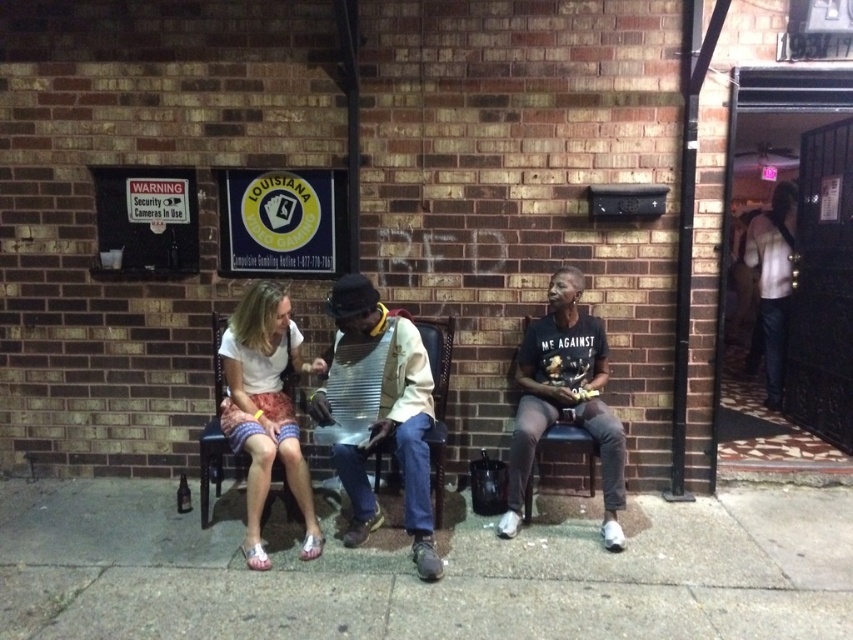
Between gray concrete pavement at lower center and white shirt at right, which one is positioned higher?

white shirt at right is above.

Consider the image. Is gray concrete pavement at lower center wider than white shirt at right?

Yes, gray concrete pavement at lower center is wider than white shirt at right.

Where is `gray concrete pavement at lower center`? gray concrete pavement at lower center is located at coordinates (415, 576).

Looking at this image, does black matte t-shirt at center appear under white shirt at right?

Indeed, black matte t-shirt at center is positioned under white shirt at right.

Is black matte t-shirt at center smaller than white shirt at right?

No.

Is point (538, 419) positioned in front of point (781, 230)?

Yes, point (538, 419) is in front of point (781, 230).

The image size is (853, 640). Find the location of `black matte t-shirt at center`. black matte t-shirt at center is located at coordinates (564, 400).

This screenshot has height=640, width=853. Describe the element at coordinates (265, 408) in the screenshot. I see `white fabric skirt at center` at that location.

Which is behind, point (242, 349) or point (758, 333)?

Positioned behind is point (758, 333).

Locate an element on the screen. The image size is (853, 640). white fabric skirt at center is located at coordinates (265, 408).